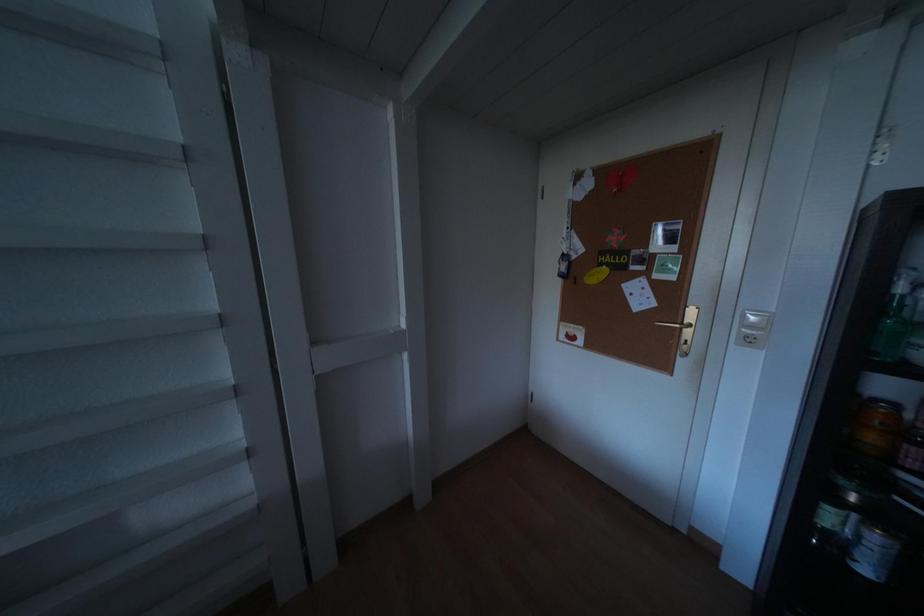
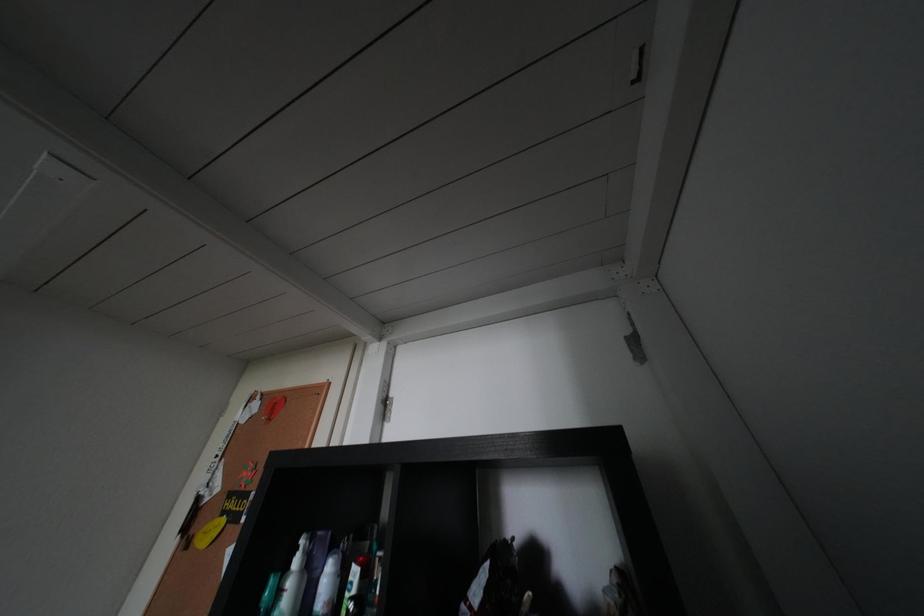
How did the camera likely rotate?

The camera rotated toward right-up.